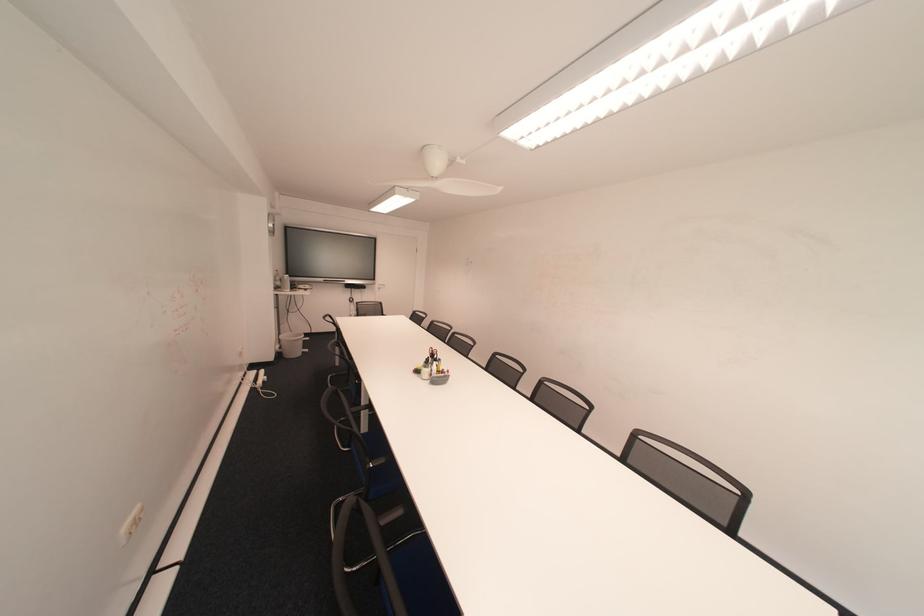
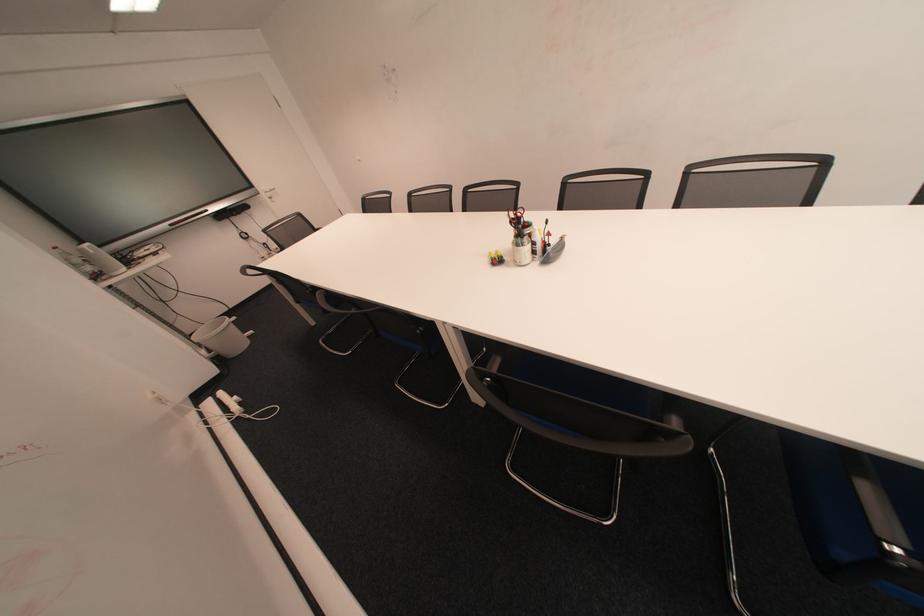
In the second image, find the point that corresponds to pixel 436 368 in the first image.

(529, 245)